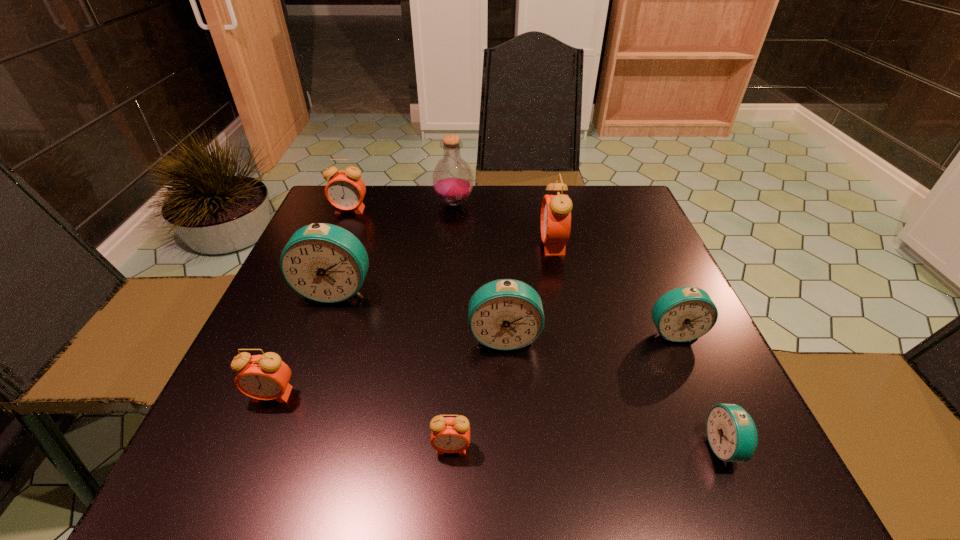
I want to click on free location located 0.060m on the front-facing side of the second blue alarm clock from left to right, so click(x=507, y=380).

Where is `free space located 0.140m on the face of the second smallest pink alarm clock`? free space located 0.140m on the face of the second smallest pink alarm clock is located at coordinates (233, 488).

What are the coordinates of `free space located 0.080m on the front-facing side of the second smallest blue alarm clock` in the screenshot? It's located at (695, 380).

Find the location of a particular element. free location located 0.110m on the front-facing side of the nearest blue alarm clock is located at coordinates (638, 447).

Identify the location of free space located 0.390m on the front-facing side of the nearest blue alarm clock. The width and height of the screenshot is (960, 540). (460, 447).

Where is `vacant space positioned 0.280m on the front-facing side of the nearest blue alarm clock`? vacant space positioned 0.280m on the front-facing side of the nearest blue alarm clock is located at coordinates (530, 447).

At what (x,y) coordinates should I click in order to perform the action: click on bottle located in the far edge section of the desktop. Please return your answer as a coordinate pair (x, y). This screenshot has height=540, width=960. Looking at the image, I should click on (452, 179).

This screenshot has height=540, width=960. What are the coordinates of `object located at the far left corner` in the screenshot? It's located at (345, 190).

Locate an element on the screen. object that is positioned at the near right corner is located at coordinates (731, 432).

In the image, there is a desktop. At what (x,y) coordinates should I click in order to perform the action: click on vacant space at the far edge. Please return your answer as a coordinate pair (x, y). The image size is (960, 540). Looking at the image, I should click on (499, 194).